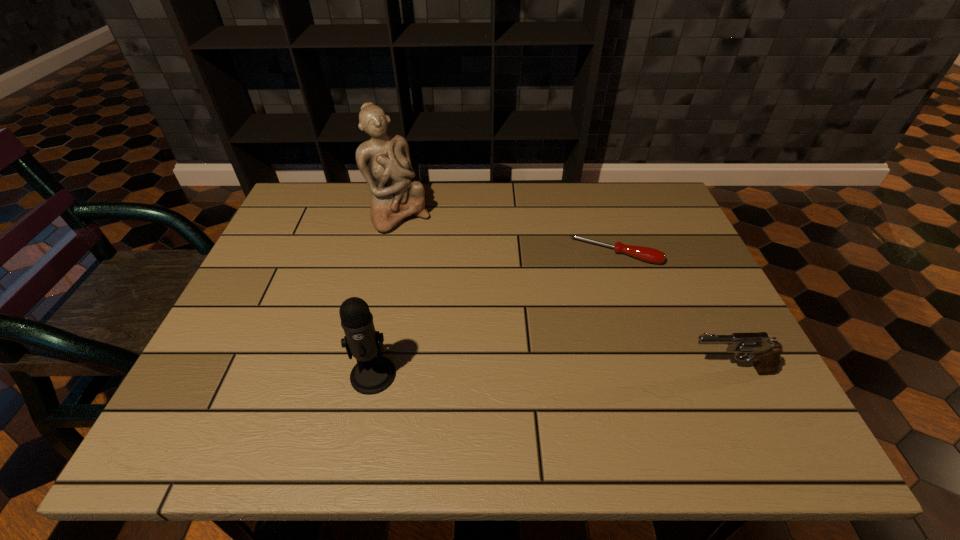
You are a GUI agent. You are given a task and a screenshot of the screen. Output one action in this format:
    pyautogui.click(x=<x>, y=<y>)
    Task: Click on the empty space that is in between the pistol and the tallest object
    
    Given the screenshot: What is the action you would take?
    point(564,294)

Locate an element on the screen. This screenshot has height=540, width=960. free space between the tallest object and the screwdriver is located at coordinates (507, 235).

Where is `empty space between the third tallest object and the microphone`? Image resolution: width=960 pixels, height=540 pixels. empty space between the third tallest object and the microphone is located at coordinates (551, 373).

What are the coordinates of `empty space that is in between the second tallest object and the farthest object` in the screenshot? It's located at (386, 295).

Where is `free space between the second tallest object and the second shortest object`? Image resolution: width=960 pixels, height=540 pixels. free space between the second tallest object and the second shortest object is located at coordinates (551, 373).

The height and width of the screenshot is (540, 960). In order to click on free spot between the second tallest object and the tallest object in this screenshot , I will do `click(386, 295)`.

Identify the location of free space between the pistol and the screwdriver. Image resolution: width=960 pixels, height=540 pixels. point(672,312).

Find the location of a particular element. This screenshot has width=960, height=540. free point between the tallest object and the third tallest object is located at coordinates (564, 294).

This screenshot has height=540, width=960. I want to click on unoccupied position between the pistol and the screwdriver, so click(x=672, y=312).

I want to click on object that stands as the second closest to the microphone, so click(647, 254).